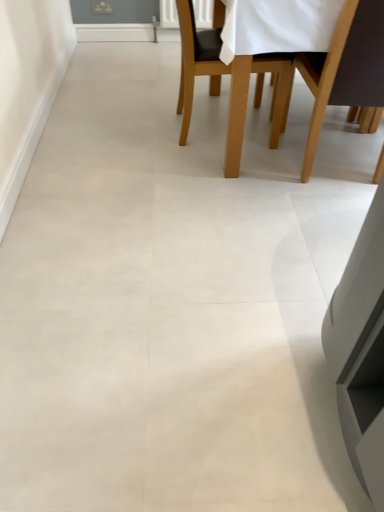
The image size is (384, 512). What do you see at coordinates (197, 61) in the screenshot? I see `light brown wooden chair at upper center, which appears as the 1th chair when viewed from the left` at bounding box center [197, 61].

This screenshot has height=512, width=384. I want to click on light brown wooden chair at upper center, acting as the 2th chair starting from the right, so click(197, 61).

This screenshot has width=384, height=512. I want to click on brown wood chair at upper right, acting as the second chair starting from the left, so click(x=347, y=72).

Image resolution: width=384 pixels, height=512 pixels. Describe the element at coordinates (347, 72) in the screenshot. I see `brown wood chair at upper right, acting as the second chair starting from the left` at that location.

How much space does brown wood chair at upper right, acting as the second chair starting from the left, occupy horizontally?

26.87 centimeters.

Locate an element on the screen. This screenshot has width=384, height=512. light brown wooden chair at upper center, acting as the 2th chair starting from the right is located at coordinates pyautogui.click(x=197, y=61).

Can you confirm if light brown wooden chair at upper center, acting as the 2th chair starting from the right, is positioned to the left of brown wood chair at upper right, the first chair positioned from the right?

Correct, you'll find light brown wooden chair at upper center, acting as the 2th chair starting from the right, to the left of brown wood chair at upper right, the first chair positioned from the right.

Is the position of light brown wooden chair at upper center, which appears as the 1th chair when viewed from the left, less distant than that of brown wood chair at upper right, acting as the second chair starting from the left?

No, light brown wooden chair at upper center, which appears as the 1th chair when viewed from the left, is further to the viewer.

Is point (213, 52) positioned in front of point (359, 38)?

No.

From the image's perspective, who appears lower, light brown wooden chair at upper center, which appears as the 1th chair when viewed from the left, or brown wood chair at upper right, acting as the second chair starting from the left?

brown wood chair at upper right, acting as the second chair starting from the left, from the image's perspective.

From a real-world perspective, does light brown wooden chair at upper center, acting as the 2th chair starting from the right, sit lower than brown wood chair at upper right, the first chair positioned from the right?

Yes, from a real-world perspective, light brown wooden chair at upper center, acting as the 2th chair starting from the right, is under brown wood chair at upper right, the first chair positioned from the right.

Considering the sizes of light brown wooden chair at upper center, which appears as the 1th chair when viewed from the left, and brown wood chair at upper right, acting as the second chair starting from the left, in the image, is light brown wooden chair at upper center, which appears as the 1th chair when viewed from the left, wider or thinner than brown wood chair at upper right, acting as the second chair starting from the left,?

In the image, light brown wooden chair at upper center, which appears as the 1th chair when viewed from the left, appears to be wider than brown wood chair at upper right, acting as the second chair starting from the left.

Considering the relative sizes of light brown wooden chair at upper center, acting as the 2th chair starting from the right, and brown wood chair at upper right, the first chair positioned from the right, in the image provided, is light brown wooden chair at upper center, acting as the 2th chair starting from the right, taller than brown wood chair at upper right, the first chair positioned from the right,?

No.

Considering the relative sizes of light brown wooden chair at upper center, which appears as the 1th chair when viewed from the left, and brown wood chair at upper right, acting as the second chair starting from the left, in the image provided, is light brown wooden chair at upper center, which appears as the 1th chair when viewed from the left, bigger than brown wood chair at upper right, acting as the second chair starting from the left,?

Yes.

Is light brown wooden chair at upper center, acting as the 2th chair starting from the right, located outside brown wood chair at upper right, acting as the second chair starting from the left?

Yes, light brown wooden chair at upper center, acting as the 2th chair starting from the right, is not within brown wood chair at upper right, acting as the second chair starting from the left.

Is light brown wooden chair at upper center, acting as the 2th chair starting from the right, not near brown wood chair at upper right, acting as the second chair starting from the left?

That's not correct — light brown wooden chair at upper center, acting as the 2th chair starting from the right, is a little close to brown wood chair at upper right, acting as the second chair starting from the left.

Is light brown wooden chair at upper center, which appears as the 1th chair when viewed from the left, facing towards brown wood chair at upper right, acting as the second chair starting from the left?

No, light brown wooden chair at upper center, which appears as the 1th chair when viewed from the left, is not facing towards brown wood chair at upper right, acting as the second chair starting from the left.

I want to click on chair below the brown wood chair at upper right, the first chair positioned from the right (from a real-world perspective), so click(x=197, y=61).

Is brown wood chair at upper right, the first chair positioned from the right, to the right of light brown wooden chair at upper center, acting as the 2th chair starting from the right, from the viewer's perspective?

Indeed, brown wood chair at upper right, the first chair positioned from the right, is positioned on the right side of light brown wooden chair at upper center, acting as the 2th chair starting from the right.

Considering the positions of objects brown wood chair at upper right, acting as the second chair starting from the left, and light brown wooden chair at upper center, which appears as the 1th chair when viewed from the left, in the image provided, who is behind, brown wood chair at upper right, acting as the second chair starting from the left, or light brown wooden chair at upper center, which appears as the 1th chair when viewed from the left,?

light brown wooden chair at upper center, which appears as the 1th chair when viewed from the left, is behind.

Is point (371, 7) behind point (258, 95)?

No, it is in front of (258, 95).

From the image's perspective, which is above, brown wood chair at upper right, acting as the second chair starting from the left, or light brown wooden chair at upper center, acting as the 2th chair starting from the right?

light brown wooden chair at upper center, acting as the 2th chair starting from the right.

From a real-world perspective, is brown wood chair at upper right, acting as the second chair starting from the left, physically located above or below light brown wooden chair at upper center, acting as the 2th chair starting from the right?

Clearly, from a real-world perspective, brown wood chair at upper right, acting as the second chair starting from the left, is above light brown wooden chair at upper center, acting as the 2th chair starting from the right.

Between brown wood chair at upper right, acting as the second chair starting from the left, and light brown wooden chair at upper center, which appears as the 1th chair when viewed from the left, which one has larger width?

light brown wooden chair at upper center, which appears as the 1th chair when viewed from the left, is wider.

Looking at this image, between brown wood chair at upper right, acting as the second chair starting from the left, and light brown wooden chair at upper center, which appears as the 1th chair when viewed from the left, which one has less height?

light brown wooden chair at upper center, which appears as the 1th chair when viewed from the left, is shorter.

Which of these two, brown wood chair at upper right, acting as the second chair starting from the left, or light brown wooden chair at upper center, acting as the 2th chair starting from the right, is smaller?

brown wood chair at upper right, acting as the second chair starting from the left, is smaller.

Is brown wood chair at upper right, acting as the second chair starting from the left, located outside light brown wooden chair at upper center, acting as the 2th chair starting from the right?

Yes, brown wood chair at upper right, acting as the second chair starting from the left, is located beyond the bounds of light brown wooden chair at upper center, acting as the 2th chair starting from the right.

From the picture: Is brown wood chair at upper right, acting as the second chair starting from the left, positioned far away from light brown wooden chair at upper center, which appears as the 1th chair when viewed from the left?

They are positioned close to each other.

Is brown wood chair at upper right, acting as the second chair starting from the left, looking in the opposite direction of light brown wooden chair at upper center, acting as the 2th chair starting from the right?

brown wood chair at upper right, acting as the second chair starting from the left, does not have its back to light brown wooden chair at upper center, acting as the 2th chair starting from the right.

Identify the location of chair located below the light brown wooden chair at upper center, which appears as the 1th chair when viewed from the left (from the image's perspective). This screenshot has width=384, height=512. (347, 72).

Find the location of a particular element. chair lying above the brown wood chair at upper right, the first chair positioned from the right (from the image's perspective) is located at coordinates tap(197, 61).

You are a GUI agent. You are given a task and a screenshot of the screen. Output one action in this format:
    pyautogui.click(x=<x>, y=<y>)
    Task: Click on the chair on the right side of light brown wooden chair at upper center, which appears as the 1th chair when viewed from the left
    
    Given the screenshot: What is the action you would take?
    pyautogui.click(x=347, y=72)